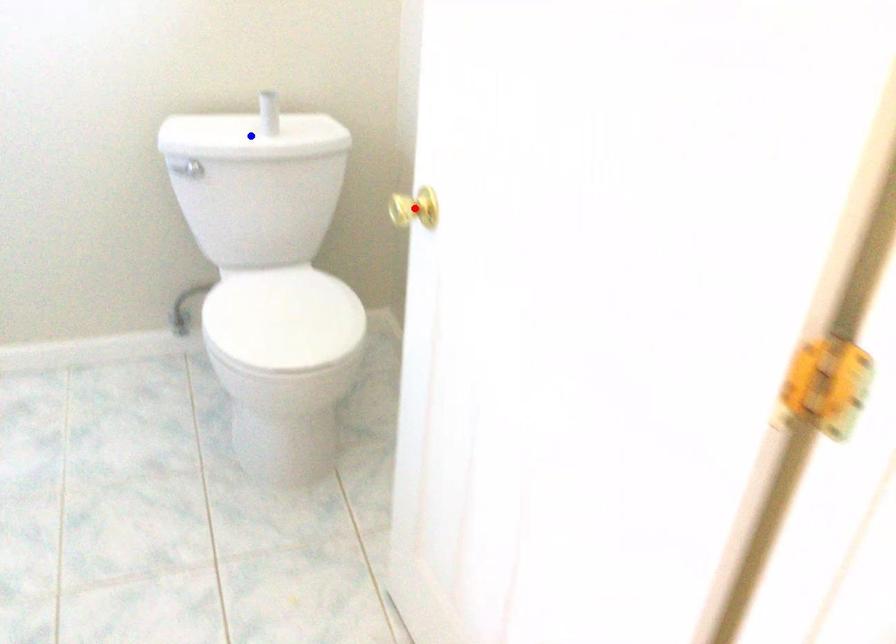
Question: Which of the two points in the image is closer to the camera?

Choices:
 (A) Blue point is closer.
 (B) Red point is closer.

Answer: (B)